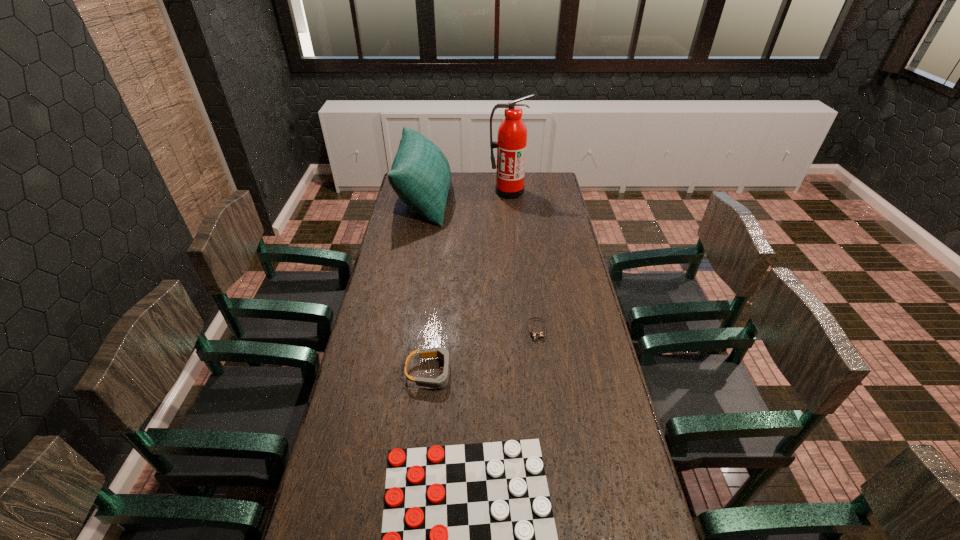
What are the coordinates of `fire extinguisher that is positioned at the far edge` in the screenshot? It's located at (511, 144).

Identify the location of cushion that is at the far edge. (420, 175).

Locate an element on the screen. The height and width of the screenshot is (540, 960). object present at the left edge is located at coordinates (420, 175).

This screenshot has width=960, height=540. Identify the location of object that is at the far left corner. (420, 175).

The image size is (960, 540). I want to click on vacant area at the far edge, so click(x=479, y=188).

This screenshot has height=540, width=960. Identify the location of free space at the left edge of the desktop. (420, 242).

At what (x,y) coordinates should I click in order to perform the action: click on free space at the right edge of the desktop. Please return your answer as a coordinate pair (x, y). Image resolution: width=960 pixels, height=540 pixels. Looking at the image, I should click on (633, 520).

In order to click on free point between the cushion and the fourth farthest object in this screenshot , I will do `click(428, 286)`.

Where is `blank region between the taller goggles and the second tallest object`? Image resolution: width=960 pixels, height=540 pixels. blank region between the taller goggles and the second tallest object is located at coordinates (428, 286).

What are the coordinates of `free space between the shorter goggles and the fourth farthest object` in the screenshot? It's located at (484, 352).